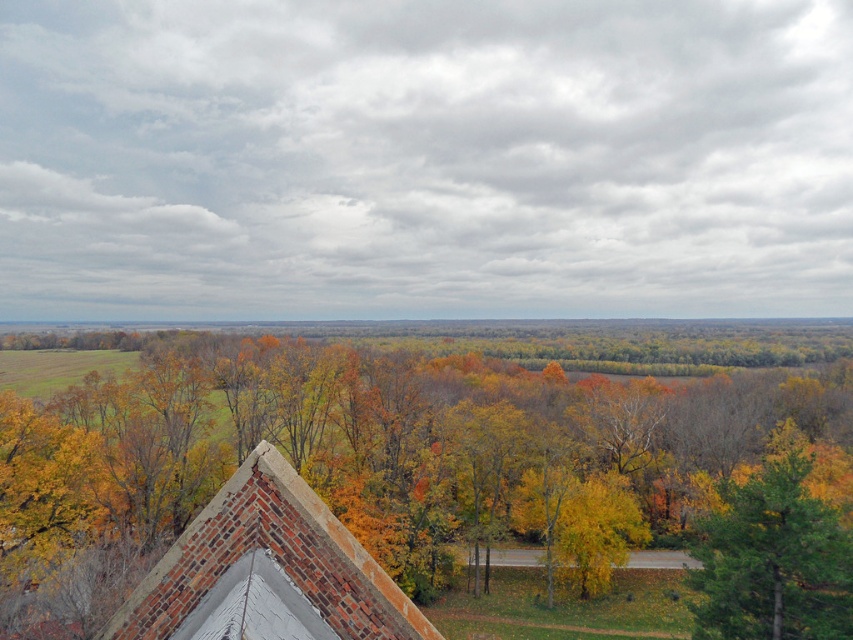
Who is lower down, brick at center or green matte tree at lower right?

green matte tree at lower right is below.

Image resolution: width=853 pixels, height=640 pixels. Describe the element at coordinates (267, 572) in the screenshot. I see `brick at center` at that location.

Image resolution: width=853 pixels, height=640 pixels. Find the location of `brick at center`. brick at center is located at coordinates (267, 572).

Is yellow leaves at center shorter than brick at center?

No.

Does yellow leaves at center have a lesser width compared to brick at center?

No, yellow leaves at center is not thinner than brick at center.

Is point (51, 524) more distant than point (399, 630)?

Yes, it is behind point (399, 630).

Find the location of `yellow leaves at center`. yellow leaves at center is located at coordinates (386, 456).

Is yellow leaves at center further to camera compared to green matte tree at lower right?

No, it is not.

Measure the distance between yellow leaves at center and camera.

They are 35.05 meters apart.

Where is `yellow leaves at center`? yellow leaves at center is located at coordinates (386, 456).